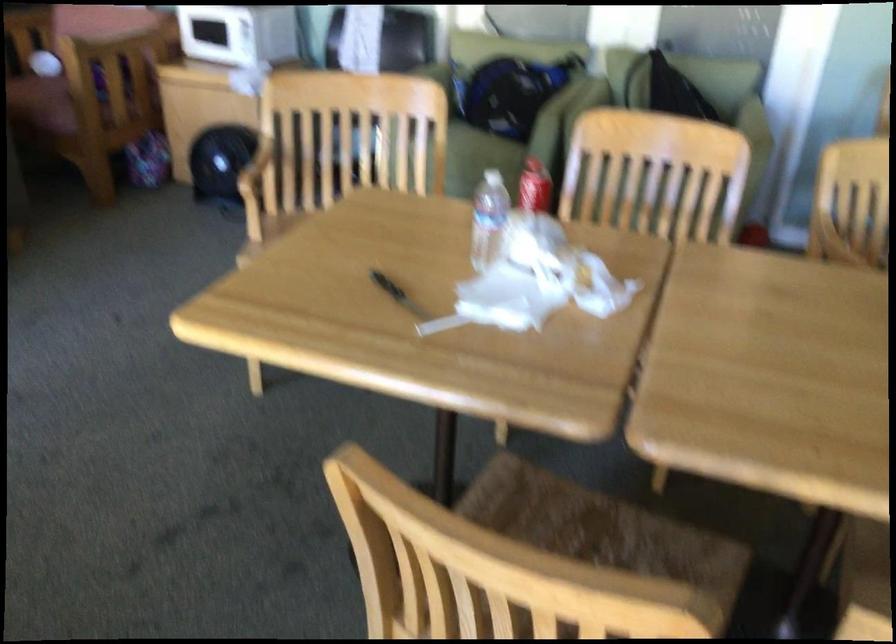
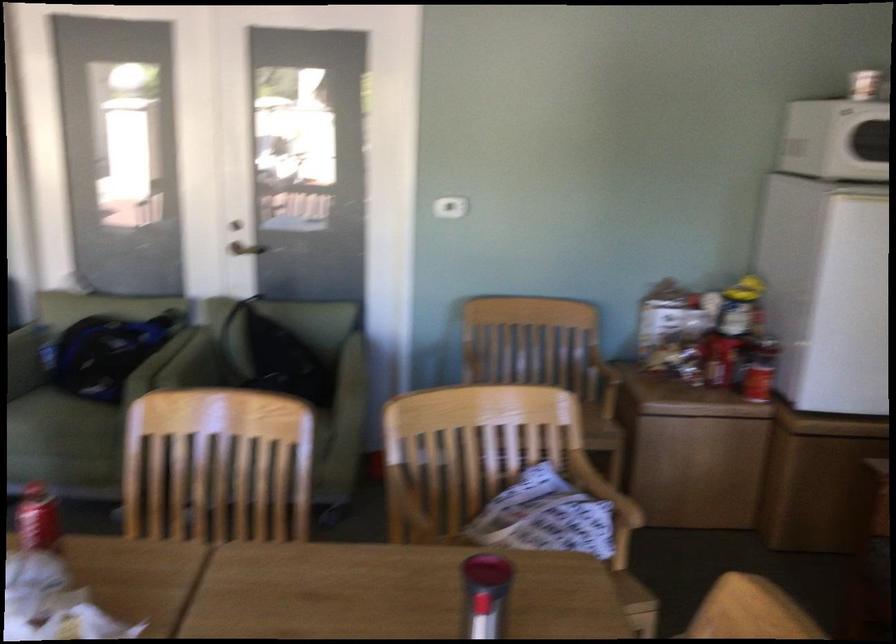
Find the pixel in the second image that matches pixel 536 187 in the first image.

(37, 518)